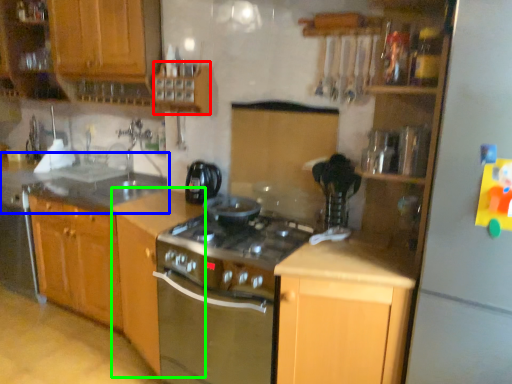
Question: Based on their relative distances, which object is nearer to cabinetry (highlighted by a red box)? Choose from countertop (highlighted by a blue box) and cabinetry (highlighted by a green box).

Choices:
 (A) countertop
 (B) cabinetry

Answer: (B)